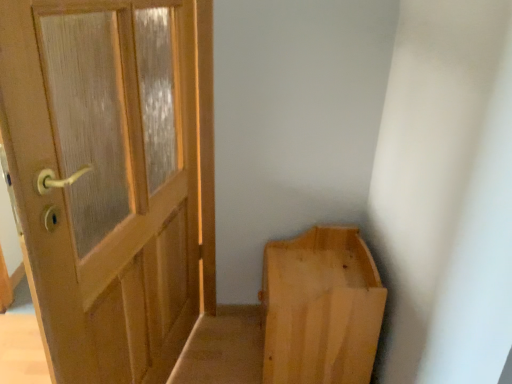
Image resolution: width=512 pixels, height=384 pixels. In order to click on free space that is to the left of light wood/rough plank bench at lower right in this screenshot , I will do `click(233, 347)`.